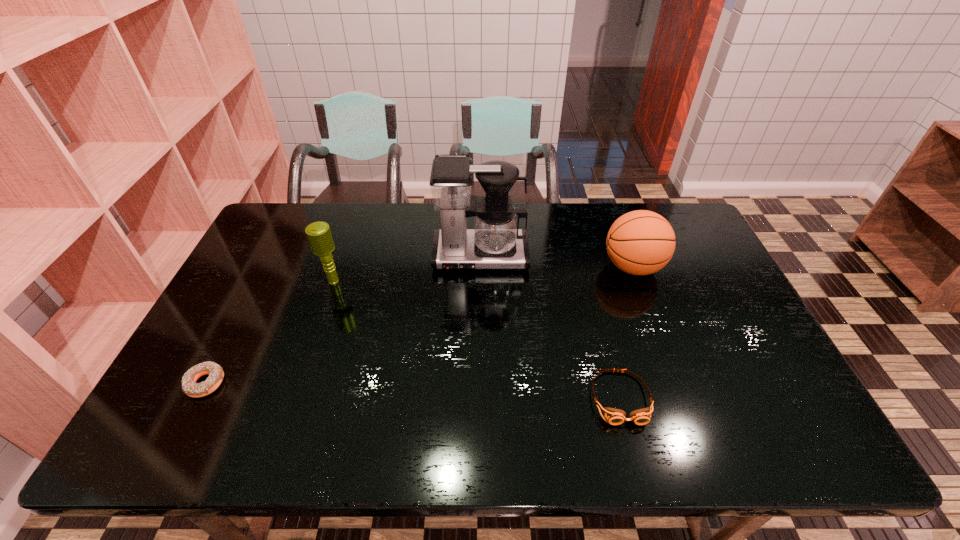
I want to click on vacant area situated with the lenses facing forward on the goggles, so click(633, 448).

In order to click on vacant space located on the back of the doughnut in this screenshot , I will do `click(256, 284)`.

The width and height of the screenshot is (960, 540). Find the location of `object that is at the far edge`. object that is at the far edge is located at coordinates (496, 242).

At what (x,y) coordinates should I click in order to perform the action: click on object that is at the near edge. Please return your answer as a coordinate pair (x, y). This screenshot has height=540, width=960. Looking at the image, I should click on (614, 416).

Locate an element on the screen. Image resolution: width=960 pixels, height=540 pixels. object located in the left edge section of the desktop is located at coordinates (189, 386).

Locate an element on the screen. free space at the far edge is located at coordinates (578, 214).

What are the coordinates of `free location at the right edge` in the screenshot? It's located at (717, 319).

Locate an element on the screen. Image resolution: width=960 pixels, height=540 pixels. vacant space at the far left corner is located at coordinates (297, 225).

Find the location of `vacant space at the far right corner of the desktop`. vacant space at the far right corner of the desktop is located at coordinates (645, 208).

The width and height of the screenshot is (960, 540). Find the location of `empty location between the second shortest object and the doughnut`. empty location between the second shortest object and the doughnut is located at coordinates (413, 390).